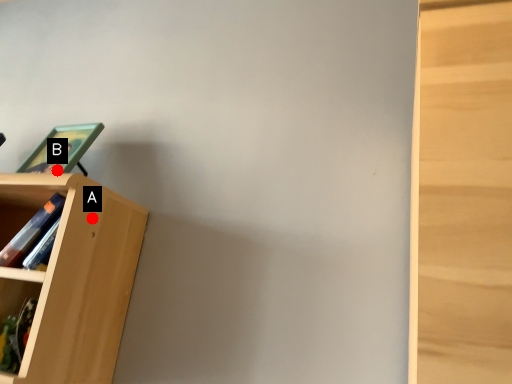
Question: Two points are circled on the image, labeled by A and B beside each circle. Which point is farther from the camera taking this photo?

Choices:
 (A) A is further
 (B) B is further

Answer: (B)